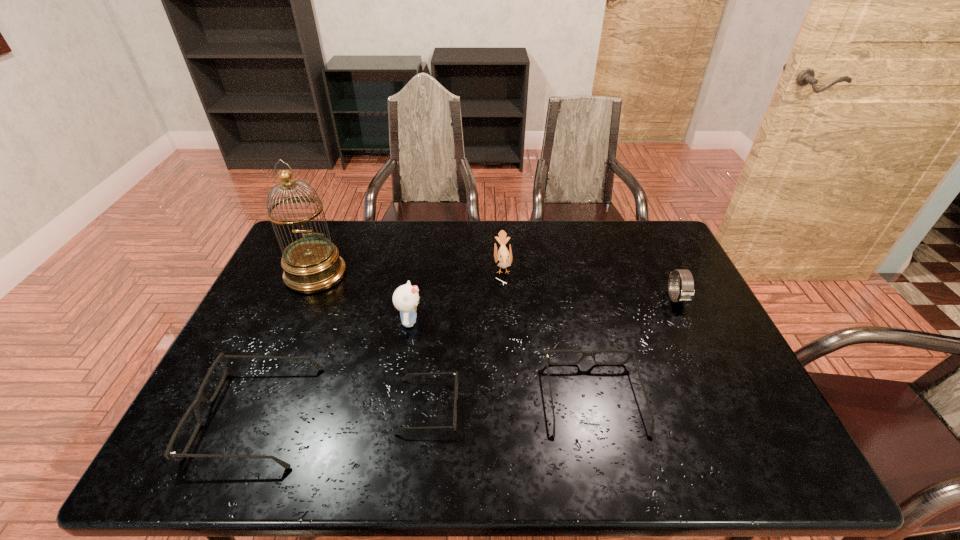
At what (x,y) coordinates should I click in order to perform the action: click on vacant point located on the front-facing side of the shortest spectacles. Please return your answer as a coordinate pair (x, y). The width and height of the screenshot is (960, 540). Looking at the image, I should click on (542, 406).

I want to click on free space located 0.380m on the front-facing side of the second tallest spectacles, so click(x=564, y=269).

The height and width of the screenshot is (540, 960). I want to click on vacant space located on the front-facing side of the second tallest spectacles, so click(565, 273).

Locate an element on the screen. vacant space situated 0.310m on the front-facing side of the second tallest spectacles is located at coordinates (568, 284).

The height and width of the screenshot is (540, 960). I want to click on vacant space located 0.050m on the front-facing side of the fourth farthest object, so click(441, 321).

Where is `free location located 0.110m on the face of the rightmost object`? free location located 0.110m on the face of the rightmost object is located at coordinates (696, 339).

You are a GUI agent. You are given a task and a screenshot of the screen. Output one action in this format:
    pyautogui.click(x=<x>, y=<y>)
    Task: Click on the vacant space located 0.150m at the beak of the third object from right to left
    The width and height of the screenshot is (960, 540).
    Given the screenshot: What is the action you would take?
    [x=447, y=266]

At what (x,y) coordinates should I click in order to perform the action: click on free point located 0.250m at the beak of the third object from right to left. Please return your answer as a coordinate pair (x, y). This screenshot has width=960, height=540. Looking at the image, I should click on (417, 266).

Identify the location of vacant region located 0.100m at the beak of the third object from right to left. The height and width of the screenshot is (540, 960). (463, 266).

Find the location of a particular element. free space located with an open door on the birdcage is located at coordinates (301, 307).